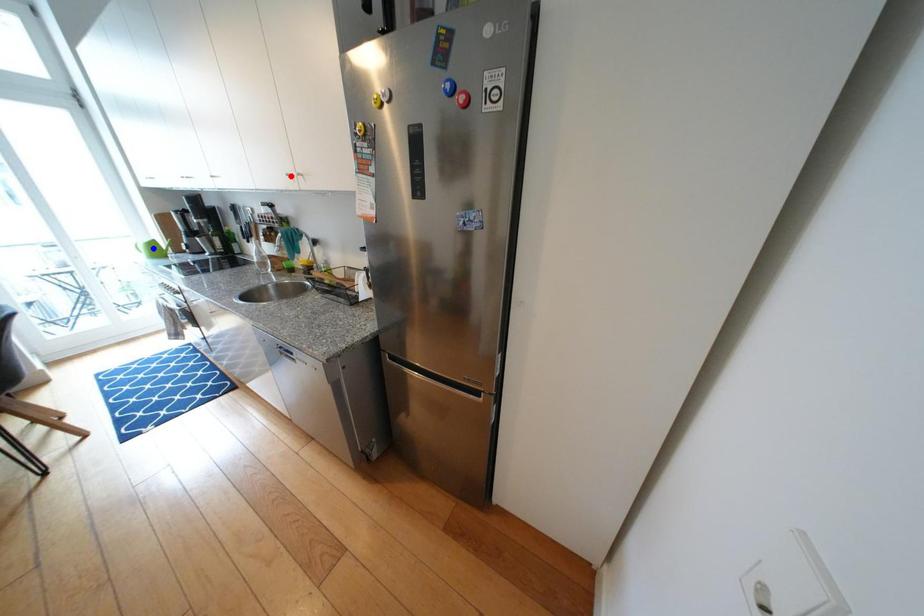
Question: Two points are marked on the image. Which point is closer to the camera?

Choices:
 (A) Blue point is closer.
 (B) Red point is closer.

Answer: (B)